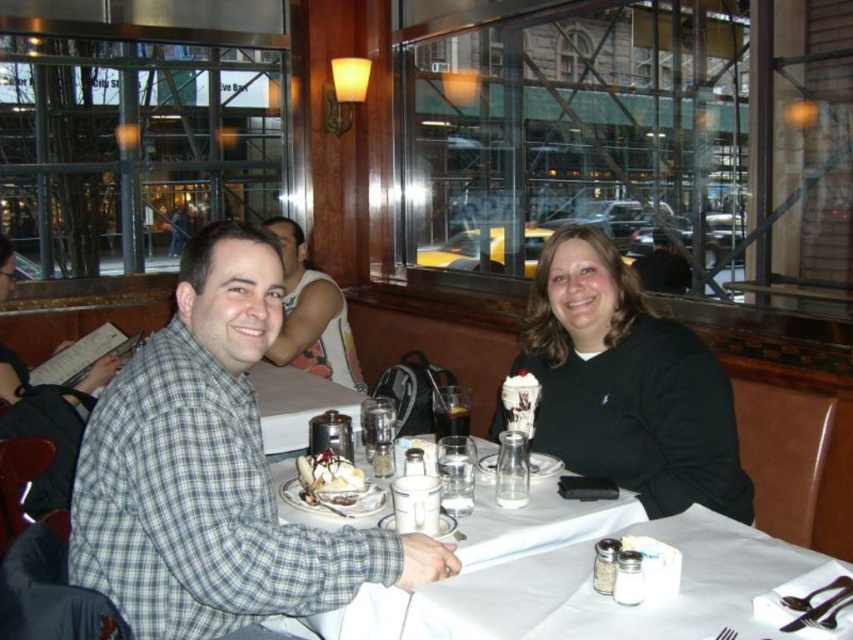
Question: Which of the following is the closest to the observer?

Choices:
 (A) (173, 337)
 (B) (553, 602)
 (C) (354, 380)
 (D) (589, 230)

Answer: (B)

Question: Which of the following is the farthest from the observer?

Choices:
 (A) white paper napkin at center
 (B) plaid shirt at center

Answer: (B)

Question: Can you confirm if plaid shirt at center is smaller than black matte sweater at center?

Choices:
 (A) no
 (B) yes

Answer: (B)

Question: Does plaid shirt at left appear over whipped cream topped sundae at center?

Choices:
 (A) yes
 (B) no

Answer: (A)

Question: Which object is farther from the camera taking this photo?

Choices:
 (A) white paper napkin at center
 (B) whipped cream topped sundae at center
 (C) black matte sweater at center
 (D) plaid shirt at left

Answer: (D)

Question: Is black matte sweater at center closer to the viewer compared to plaid shirt at left?

Choices:
 (A) no
 (B) yes

Answer: (B)